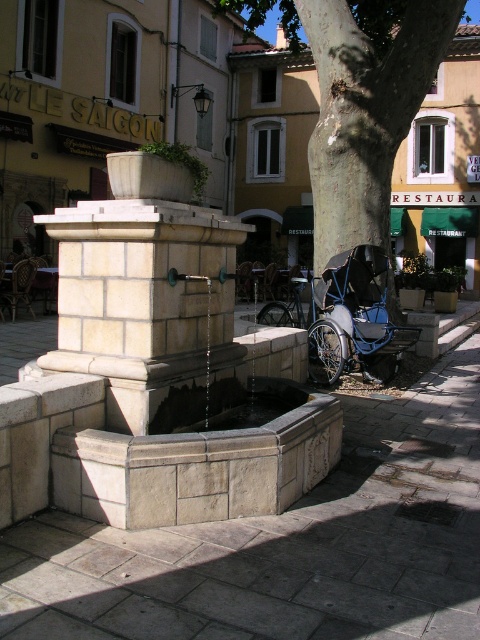
You are standing in front of the stone fountain and want to place a small statue between the two points marked as point (464,410) and point (238,387). Which point is closer to you so that the statue can be placed in front of it?

Point (464,410) is closer to you than point (238,387), so placing the statue in front of point (464,410) would position it nearer to your current location.

You are a parent pushing a blue metallic baby carriage at center along the stone pavement at center. Can you move the carriage sideways without leaving the pavement? Explain why based on the pavement width compared to the carriage.

The stone pavement at center is wider than the blue metallic baby carriage at center, so yes, you can move the carriage sideways while staying on the pavement.

You are a tourist visiting this European town and want to take a photo that includes both the white stone fountain at center and the smooth bark tree at center. Since you have a camera with a fixed focal length, you need to know which object is closer to the camera to ensure both are in focus. Based on the scene description, which object is closer?

The white stone fountain at center is smaller than the smooth bark tree at center, which suggests it is farther away. Therefore, the smooth bark tree at center is closer to the camera, so focusing on it would help both objects be in focus.